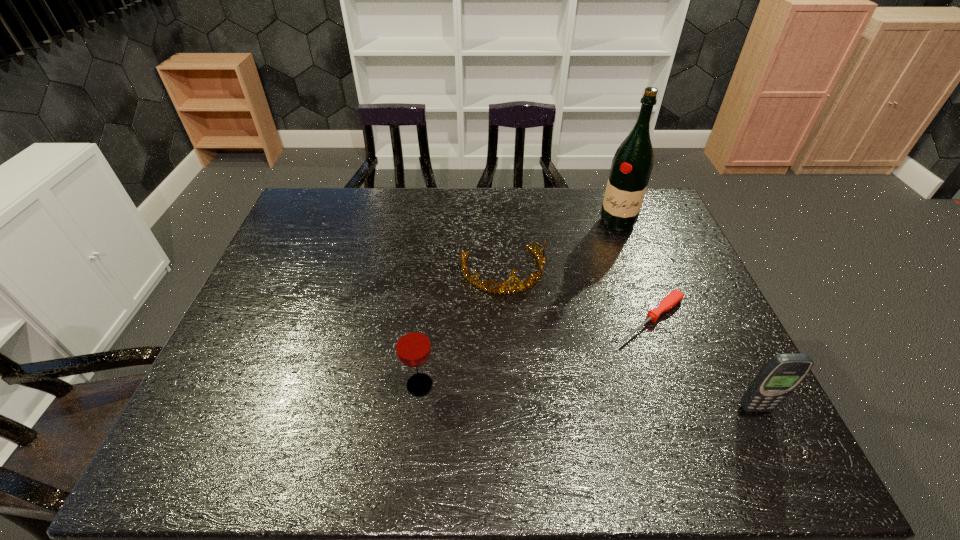
Where is `vacant area between the cellular telephone and the glass`? The width and height of the screenshot is (960, 540). vacant area between the cellular telephone and the glass is located at coordinates (588, 396).

You are a GUI agent. You are given a task and a screenshot of the screen. Output one action in this format:
    pyautogui.click(x=<x>, y=<y>)
    Task: Click on the empty location between the second object from left to right and the screwdriver
    
    Given the screenshot: What is the action you would take?
    pyautogui.click(x=577, y=295)

Where is `free area in between the liquor and the leftmost object`? This screenshot has height=540, width=960. free area in between the liquor and the leftmost object is located at coordinates (518, 303).

This screenshot has width=960, height=540. I want to click on object that stands as the third closest to the rightmost object, so click(631, 167).

Identify which object is located as the nearest to the leftmost object. Please provide its 2D coordinates. Your answer should be formatted as a tuple, i.e. [(x, y)], where the tuple contains the x and y coordinates of a point satisfying the conditions above.

[(522, 285)]

Locate an element on the screen. free space that satisfies the following two spatial constraints: 1. on the back side of the tallest object; 2. on the left side of the leftmost object is located at coordinates (438, 222).

At what (x,y) coordinates should I click in order to perform the action: click on free location that satisfies the following two spatial constraints: 1. on the back side of the leftmost object; 2. on the left side of the shortest object. Please return your answer as a coordinate pair (x, y). Looking at the image, I should click on (427, 319).